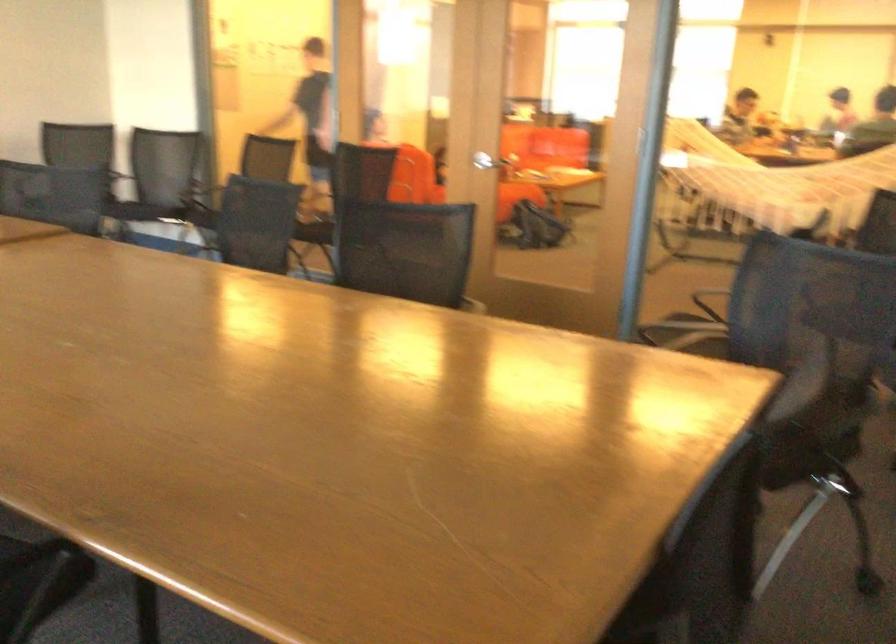
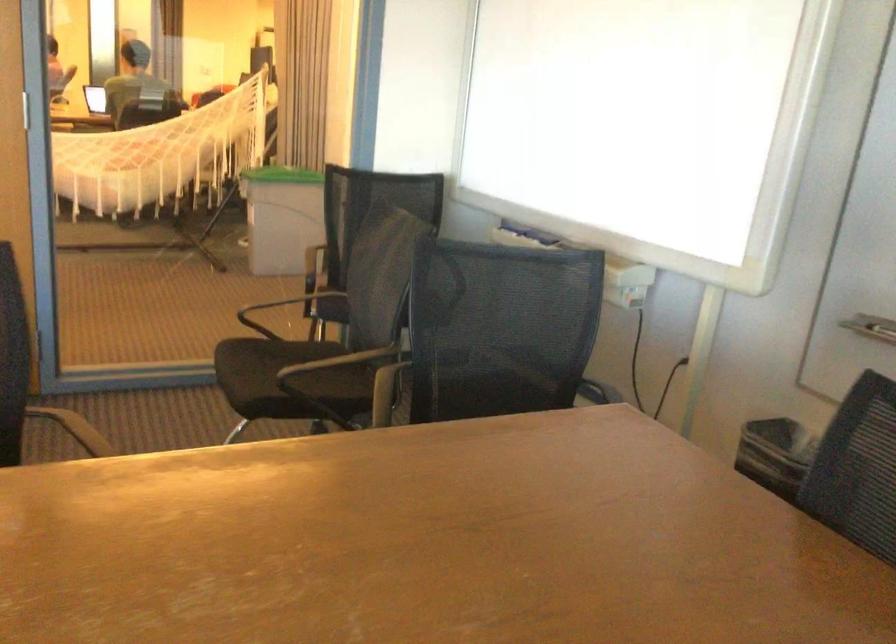
Locate, in the second image, the point that corresponds to (686,345) in the first image.

(288, 379)